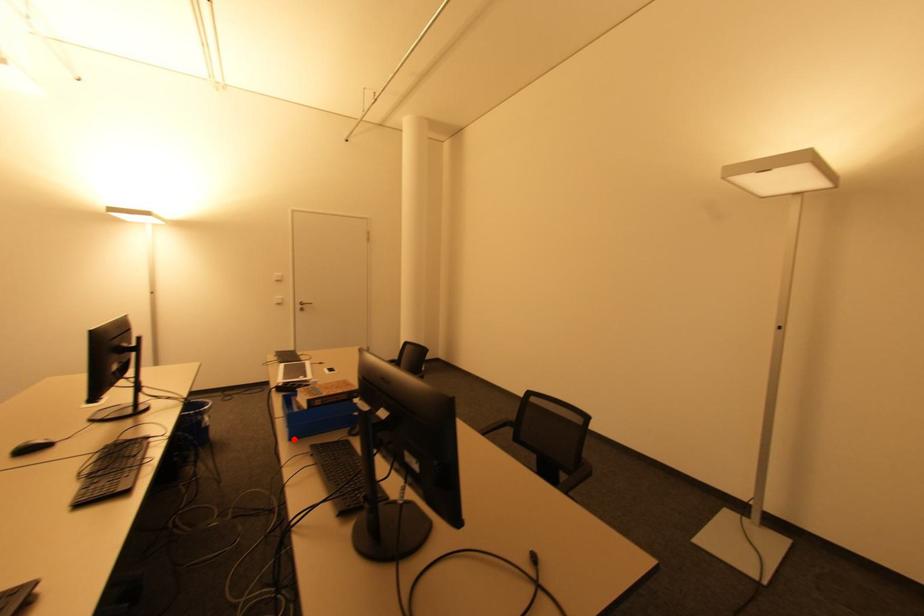
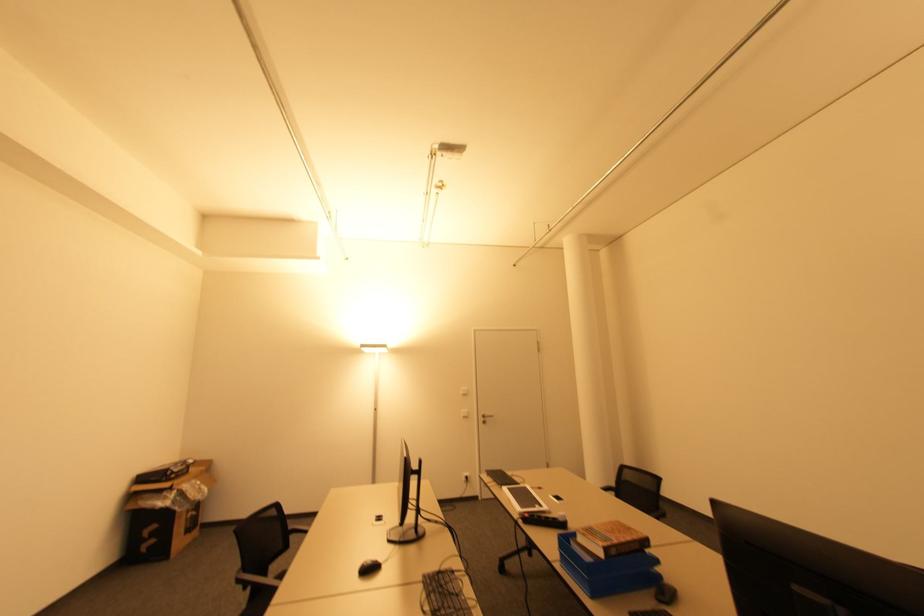
Locate, in the second image, the point that corresponds to the highlighted location in the first image.

(594, 597)